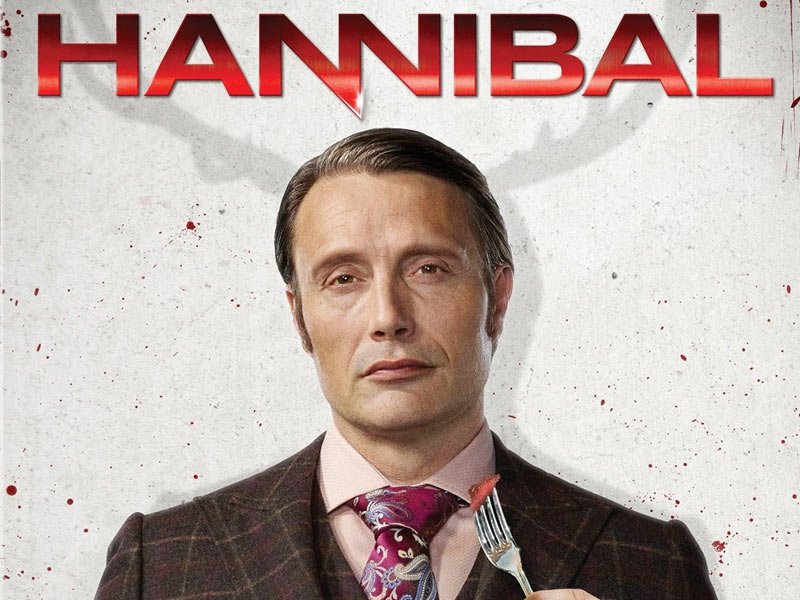
You are a GUI agent. You are given a task and a screenshot of the screen. Output one action in this format:
    pyautogui.click(x=<x>, y=<y>)
    Task: Click on the fork
    
    Given the screenshot: What is the action you would take?
    pyautogui.click(x=506, y=554)